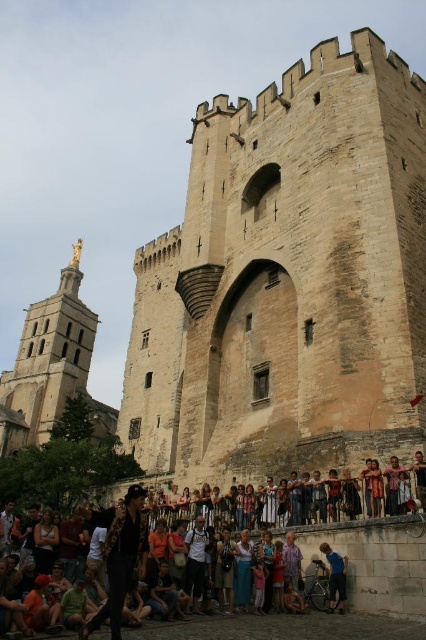
You are standing in a historic stone structure and want to place a new decorative item exactly at the location where the multicolored casual clothing at lower center is currently placed. What are the coordinates of that location?

The coordinates of the location where the multicolored casual clothing at lower center is placed are at point (373, 563).

You are a tourist visiting the historic stone structure. You notice the golden statue at upper left and the blue denim jeans at lower center in the scene. Which object is taller?

The golden statue at upper left is taller than the blue denim jeans at lower center.